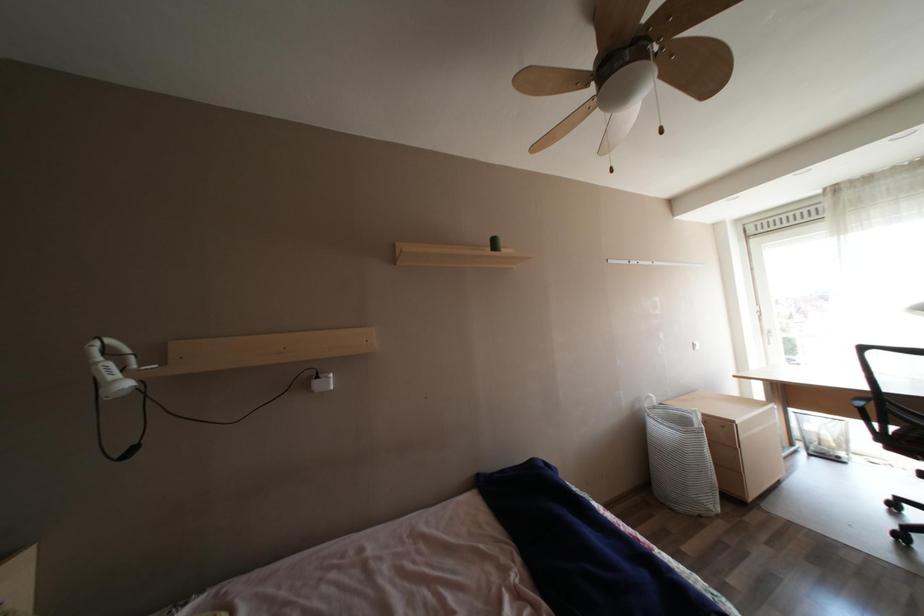
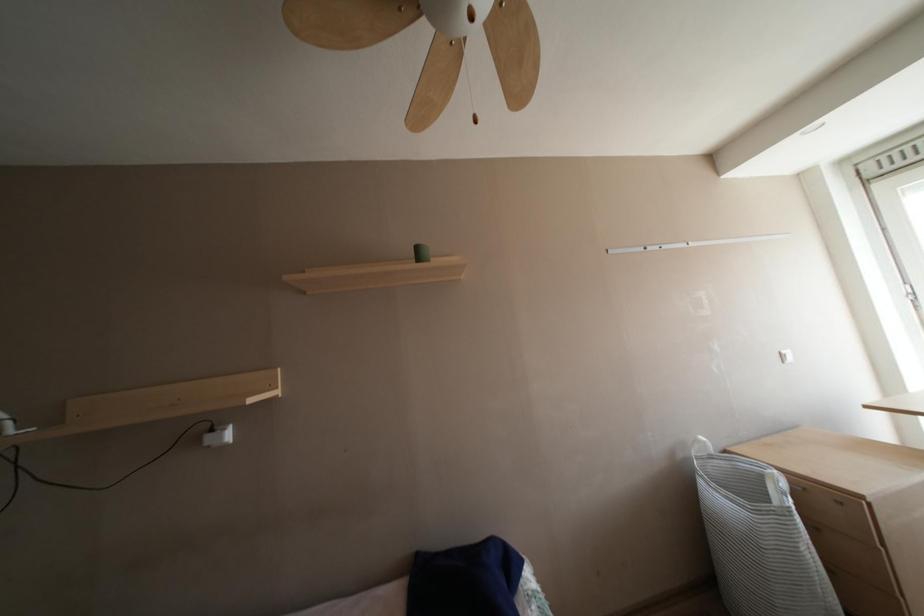
Question: How did the camera likely rotate?

Choices:
 (A) Left
 (B) Right
 (C) Up
 (D) Down

Answer: (A)